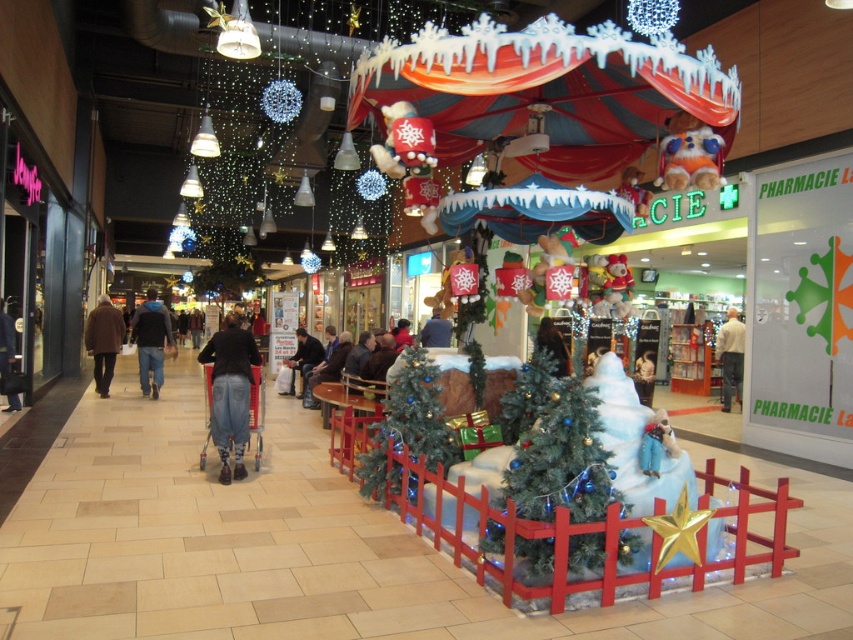
Question: Can you confirm if green matte christmas tree at center is bigger than denim jeans at center?

Choices:
 (A) no
 (B) yes

Answer: (A)

Question: Which point appears closest to the camera in this image?

Choices:
 (A) (741, 371)
 (B) (154, 353)
 (C) (296, 336)
 (D) (103, 307)

Answer: (B)

Question: Is green matte christmas tree at center positioned at the back of white cotton shirt at center?

Choices:
 (A) no
 (B) yes

Answer: (A)

Question: Can you confirm if green matte christmas tree at center is smaller than white cotton shirt at center?

Choices:
 (A) no
 (B) yes

Answer: (B)

Question: Which object is closer to the camera taking this photo?

Choices:
 (A) white cotton shirt at center
 (B) jeans at center

Answer: (B)

Question: Which of the following is the farthest from the observer?

Choices:
 (A) (425, 460)
 (B) (97, 356)
 (C) (297, 339)
 (D) (589, 476)

Answer: (C)